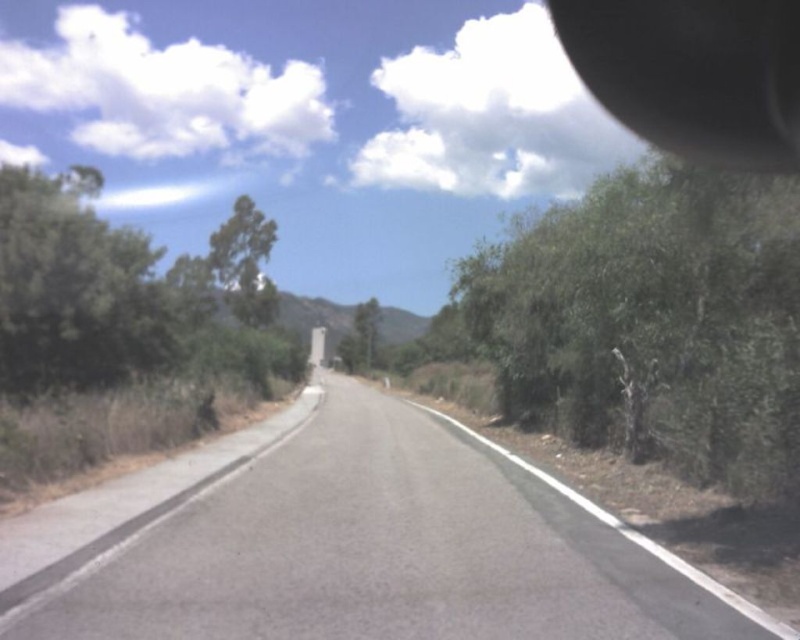
Question: Which point is farther to the camera?

Choices:
 (A) asphalt road at center
 (B) green leafy tree at upper left
 (C) green leafy tree at left

Answer: (B)

Question: Does asphalt road at center appear under green leafy tree at center?

Choices:
 (A) yes
 (B) no

Answer: (A)

Question: Does asphalt road at center appear under green leafy tree at center?

Choices:
 (A) yes
 (B) no

Answer: (A)

Question: Does asphalt road at center have a lesser width compared to green leafy tree at left?

Choices:
 (A) yes
 (B) no

Answer: (A)

Question: Which point is farther to the camera?

Choices:
 (A) green leafy tree at right
 (B) green leafy tree at left
 (C) green leafy tree at upper left

Answer: (C)

Question: Which point is farther to the camera?

Choices:
 (A) (586, 397)
 (B) (376, 336)

Answer: (B)